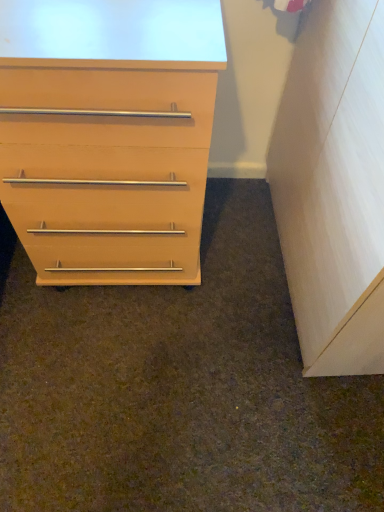
Question: Considering the relative sizes of light wood/file cabinet at right and matte wood chest of drawers at left in the image provided, is light wood/file cabinet at right taller than matte wood chest of drawers at left?

Choices:
 (A) no
 (B) yes

Answer: (B)

Question: Is matte wood chest of drawers at left inside light wood/file cabinet at right?

Choices:
 (A) yes
 (B) no

Answer: (B)

Question: Does light wood/file cabinet at right appear on the right side of matte wood chest of drawers at left?

Choices:
 (A) no
 (B) yes

Answer: (B)

Question: Does light wood/file cabinet at right have a smaller size compared to matte wood chest of drawers at left?

Choices:
 (A) yes
 (B) no

Answer: (A)

Question: Can you confirm if light wood/file cabinet at right is bigger than matte wood chest of drawers at left?

Choices:
 (A) yes
 (B) no

Answer: (B)

Question: From the image's perspective, is light wood/file cabinet at right below matte wood chest of drawers at left?

Choices:
 (A) no
 (B) yes

Answer: (B)

Question: Is matte wood chest of drawers at left not near light wood/file cabinet at right?

Choices:
 (A) no
 (B) yes

Answer: (A)

Question: From a real-world perspective, does matte wood chest of drawers at left sit lower than light wood/file cabinet at right?

Choices:
 (A) yes
 (B) no

Answer: (A)

Question: From the image's perspective, does matte wood chest of drawers at left appear higher than light wood/file cabinet at right?

Choices:
 (A) no
 (B) yes

Answer: (B)

Question: Can you confirm if matte wood chest of drawers at left is thinner than light wood/file cabinet at right?

Choices:
 (A) yes
 (B) no

Answer: (B)

Question: Is matte wood chest of drawers at left turned away from light wood/file cabinet at right?

Choices:
 (A) no
 (B) yes

Answer: (A)

Question: Is matte wood chest of drawers at left directly adjacent to light wood/file cabinet at right?

Choices:
 (A) no
 (B) yes

Answer: (A)

Question: Do you think light wood/file cabinet at right is within matte wood chest of drawers at left, or outside of it?

Choices:
 (A) inside
 (B) outside

Answer: (B)